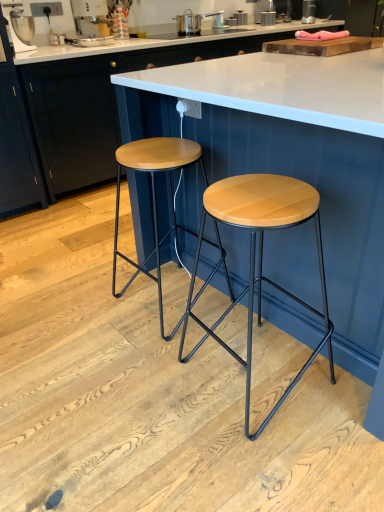
Question: From a real-world perspective, is wooden seat stool at center, arranged as the 1th stool when viewed from the left, above or below metallic silver toaster at upper center, which ranks as the 2th appliance in front-to-back order?

Choices:
 (A) above
 (B) below

Answer: (B)

Question: Visually, is wooden seat stool at center, arranged as the 1th stool when viewed from the left, positioned to the left or to the right of metallic silver toaster at upper center, which ranks as the 2th appliance in front-to-back order?

Choices:
 (A) right
 (B) left

Answer: (B)

Question: Which is farther from the metallic silver coffee machine at upper left, which is the 2th appliance in right-to-left order?

Choices:
 (A) matte white countertop at center
 (B) metallic silver toaster at upper center, placed as the second appliance when sorted from left to right
 (C) wooden seat stool at center, arranged as the 1th stool when viewed from the left
 (D) wooden stool at center, the second stool viewed from the left
 (E) wooden table at center

Answer: (D)

Question: Which of these objects is positioned farthest from the wooden seat stool at center, arranged as the 1th stool when viewed from the left?

Choices:
 (A) wooden table at center
 (B) metallic silver toaster at upper center, which ranks as the 2th appliance in front-to-back order
 (C) wooden stool at center, the second stool viewed from the left
 (D) matte white countertop at center
 (E) metallic silver coffee machine at upper left, acting as the 1th appliance starting from the front

Answer: (B)